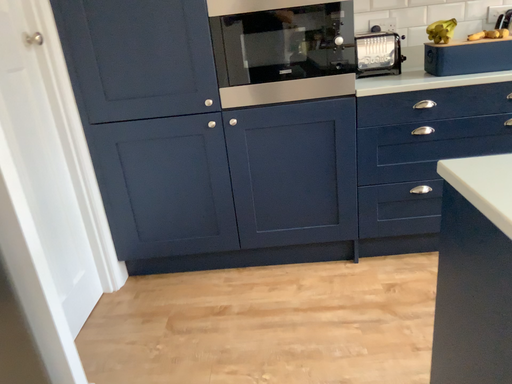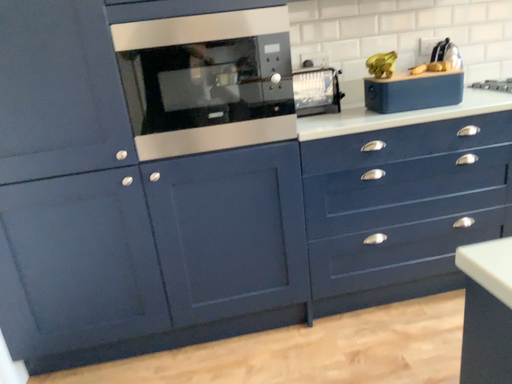
Question: How did the camera likely rotate when shooting the video?

Choices:
 (A) rotated right
 (B) rotated left

Answer: (A)